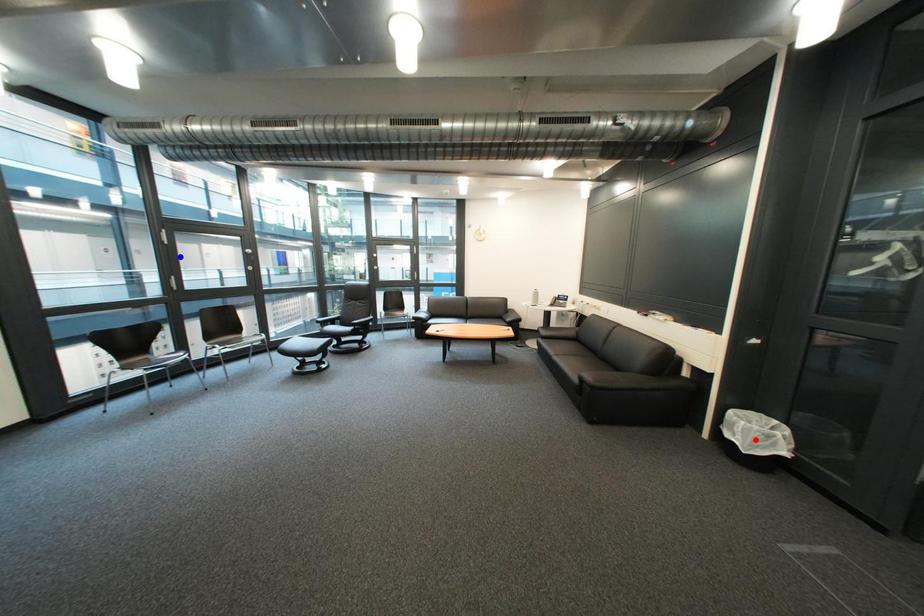
Question: Which of the two points in the image is closer to the camera?

Choices:
 (A) Blue point is closer.
 (B) Red point is closer.

Answer: (B)